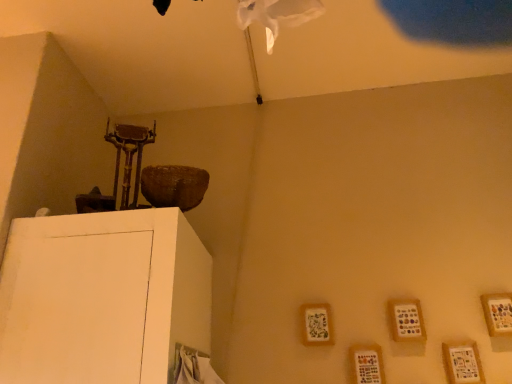
Question: From the image's perspective, is wooden frame at lower right, which appears as the 5th picture frame when viewed from the right, positioned above or below wooden frame at upper right, acting as the fifth picture frame starting from the left?

Choices:
 (A) below
 (B) above

Answer: (A)

Question: Looking at the image, does wooden frame at lower right, which appears as the 5th picture frame when viewed from the right, seem bigger or smaller compared to wooden frame at upper right, the 1th picture frame positioned from the right?

Choices:
 (A) big
 (B) small

Answer: (A)

Question: Which is nearer to the wooden frame at upper right, the 1th picture frame positioned from the right?

Choices:
 (A) wooden frame at lower right, positioned as the third picture frame in left-to-right order
 (B) wooden frame at lower right, which appears as the 5th picture frame when viewed from the right
 (C) wooden picture frame at lower right, positioned as the 2th picture frame in left-to-right order
 (D) wooden frame at lower right, arranged as the second picture frame when viewed from the right

Answer: (D)

Question: Estimate the real-world distances between objects in this image. Which object is farther from the wooden frame at lower right, positioned as the third picture frame in left-to-right order?

Choices:
 (A) wooden frame at lower right, positioned as the 1th picture frame in left-to-right order
 (B) wooden picture frame at lower right, arranged as the fourth picture frame when viewed from the right
 (C) wooden frame at lower right, which is the 4th picture frame from left to right
 (D) wooden frame at upper right, the 1th picture frame positioned from the right

Answer: (A)